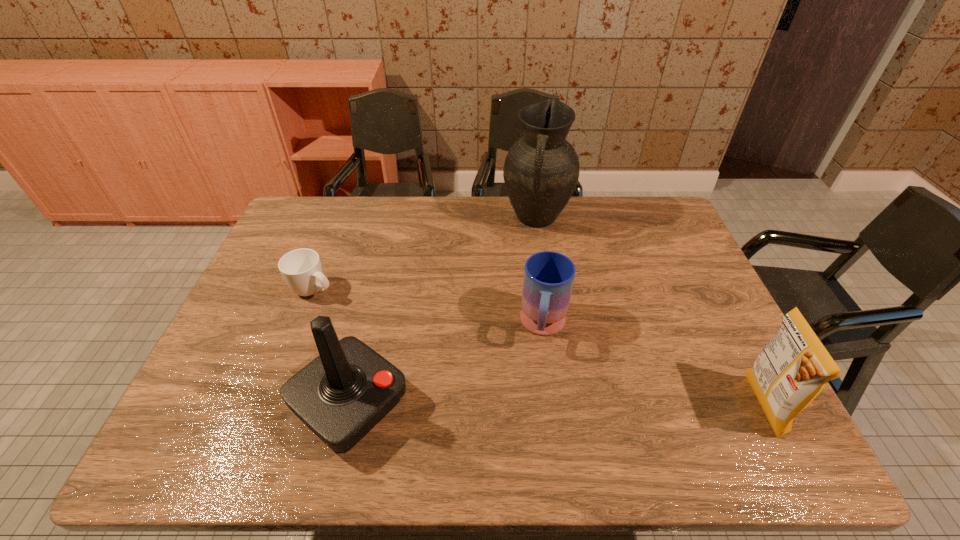
The height and width of the screenshot is (540, 960). I want to click on object present at the near right corner, so click(792, 369).

Find the location of `vacant region at the far edge of the desktop`. vacant region at the far edge of the desktop is located at coordinates (468, 198).

The height and width of the screenshot is (540, 960). I want to click on free region at the left edge of the desktop, so click(263, 275).

In order to click on free space at the right edge of the desktop in this screenshot , I will do `click(683, 248)`.

This screenshot has width=960, height=540. In the image, there is a desktop. Identify the location of blank space at the far right corner. (636, 206).

Locate an element on the screen. Image resolution: width=960 pixels, height=540 pixels. vacant point located between the joystick and the mug is located at coordinates (447, 366).

Where is `free spot between the crisp (potato chip) and the mug`? The image size is (960, 540). free spot between the crisp (potato chip) and the mug is located at coordinates (653, 366).

I want to click on vacant space that's between the joystick and the fourth tallest object, so click(x=447, y=366).

Locate an element on the screen. The image size is (960, 540). unoccupied area between the joystick and the mug is located at coordinates (447, 366).

This screenshot has width=960, height=540. In order to click on unoccupied position between the mug and the joystick in this screenshot , I will do `click(447, 366)`.